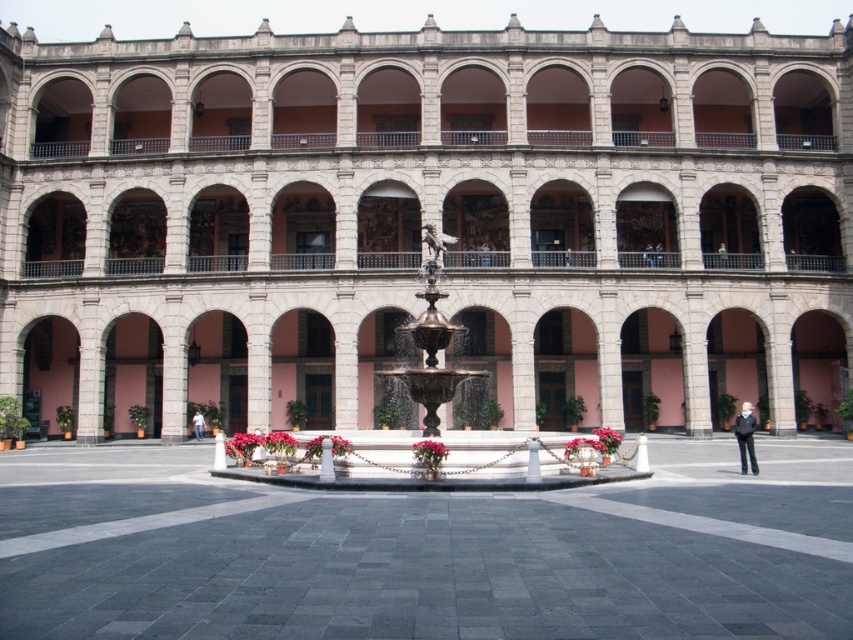
Question: Which object is closer to the camera taking this photo?

Choices:
 (A) stone fountain at center
 (B) smooth pink petals at center

Answer: (B)

Question: Is smooth pink petals at center bigger than matte pink flowers at center?

Choices:
 (A) no
 (B) yes

Answer: (B)

Question: Estimate the real-world distances between objects in this image. Which object is farther from the matte pink flowers at center?

Choices:
 (A) bronze statue at center
 (B) stone fountain at center
 (C) red matte flower at center
 (D) smooth pink petals at center

Answer: (B)

Question: Which point is closer to the camera?

Choices:
 (A) bronze/brass fountain at center
 (B) smooth pink petals at center
 (C) red matte flower at center

Answer: (A)

Question: Can you confirm if stone fountain at center is positioned to the left of matte pink flowers at center?

Choices:
 (A) yes
 (B) no

Answer: (B)

Question: Can you confirm if smooth pink petals at center is smaller than matte pink flowers at center?

Choices:
 (A) yes
 (B) no

Answer: (B)